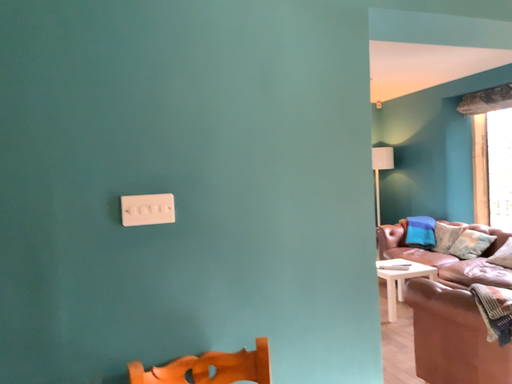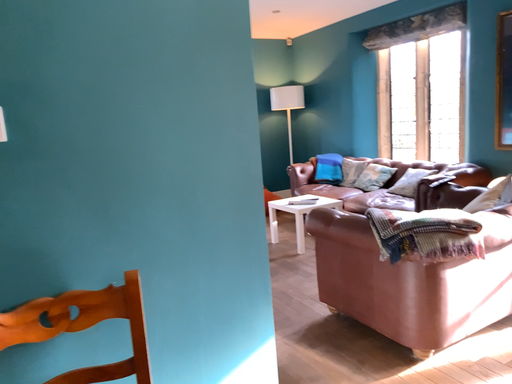
Question: How did the camera likely rotate when shooting the video?

Choices:
 (A) rotated left
 (B) rotated right

Answer: (B)